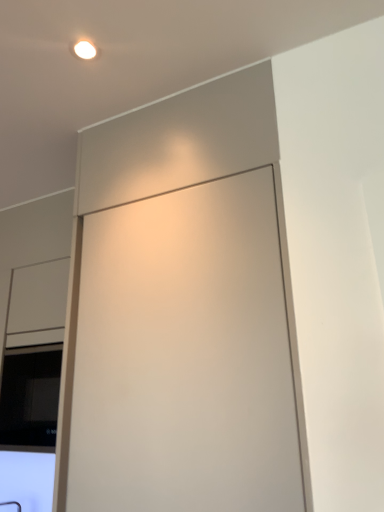
This screenshot has height=512, width=384. Describe the element at coordinates (30, 397) in the screenshot. I see `black glass window at lower left` at that location.

The height and width of the screenshot is (512, 384). In order to click on black glass window at lower left in this screenshot , I will do `click(30, 397)`.

The image size is (384, 512). What do you see at coordinates (185, 356) in the screenshot? I see `matte white cabinet at center` at bounding box center [185, 356].

Where is `matte white cabinet at center`? This screenshot has width=384, height=512. matte white cabinet at center is located at coordinates (185, 356).

This screenshot has width=384, height=512. What are the coordinates of `black glass window at lower left` in the screenshot? It's located at (30, 397).

Visually, is matte white cabinet at center positioned to the left or to the right of black glass window at lower left?

Based on their positions, matte white cabinet at center is located to the right of black glass window at lower left.

From the picture: Is matte white cabinet at center in front of black glass window at lower left?

Yes, the depth of matte white cabinet at center is less than that of black glass window at lower left.

Considering the points (248, 488) and (17, 415), which point is in front, point (248, 488) or point (17, 415)?

The point (248, 488) is closer to the camera.

Based on the photo, from the image's perspective, would you say matte white cabinet at center is shown under black glass window at lower left?

No.

From a real-world perspective, is matte white cabinet at center beneath black glass window at lower left?

No, from a real-world perspective, matte white cabinet at center is not below black glass window at lower left.

Is matte white cabinet at center wider or thinner than black glass window at lower left?

In the image, matte white cabinet at center appears to be wider than black glass window at lower left.

Which of these two, matte white cabinet at center or black glass window at lower left, stands shorter?

With less height is black glass window at lower left.

Between matte white cabinet at center and black glass window at lower left, which one has smaller size?

Smaller between the two is black glass window at lower left.

Do you think matte white cabinet at center is within black glass window at lower left, or outside of it?

matte white cabinet at center exists outside the volume of black glass window at lower left.

From the picture: Are matte white cabinet at center and black glass window at lower left far apart?

matte white cabinet at center is actually quite close to black glass window at lower left.

Is matte white cabinet at center positioned with its back to black glass window at lower left?

No, matte white cabinet at center is not facing away from black glass window at lower left.

Consider the image. Can you tell me how much matte white cabinet at center and black glass window at lower left differ in facing direction?

There is a 0.997-degree angle between the facing directions of matte white cabinet at center and black glass window at lower left.

Find the location of `window located below the matte white cabinet at center (from the image's perspective)`. window located below the matte white cabinet at center (from the image's perspective) is located at coordinates (30, 397).

Does black glass window at lower left appear on the right side of matte white cabinet at center?

In fact, black glass window at lower left is to the left of matte white cabinet at center.

Considering their positions, is black glass window at lower left located in front of or behind matte white cabinet at center?

Clearly, black glass window at lower left is behind matte white cabinet at center.

Does point (36, 411) come closer to viewer compared to point (95, 507)?

No, it is not.

From the image's perspective, is black glass window at lower left positioned above or below matte white cabinet at center?

Based on their image positions, black glass window at lower left is located beneath matte white cabinet at center.

From a real-world perspective, who is located higher, black glass window at lower left or matte white cabinet at center?

From a 3D spatial view, matte white cabinet at center is above.

Consider the image. Looking at their sizes, would you say black glass window at lower left is wider or thinner than matte white cabinet at center?

black glass window at lower left is thinner than matte white cabinet at center.

Between black glass window at lower left and matte white cabinet at center, which one has more height?

matte white cabinet at center is taller.

Who is smaller, black glass window at lower left or matte white cabinet at center?

black glass window at lower left is smaller.

Is black glass window at lower left spatially inside matte white cabinet at center, or outside of it?

The correct answer is: outside.

Would you say black glass window at lower left is a long distance from matte white cabinet at center?

Actually, black glass window at lower left and matte white cabinet at center are a little close together.

Is black glass window at lower left facing towards matte white cabinet at center?

No, black glass window at lower left is not turned towards matte white cabinet at center.

Where is `screen door above the black glass window at lower left (from the image's perspective)`? The width and height of the screenshot is (384, 512). screen door above the black glass window at lower left (from the image's perspective) is located at coordinates (185, 356).

At what (x,y) coordinates should I click in order to perform the action: click on window below the matte white cabinet at center (from the image's perspective). Please return your answer as a coordinate pair (x, y). The image size is (384, 512). Looking at the image, I should click on (30, 397).

Identify the location of screen door to the right of black glass window at lower left. This screenshot has width=384, height=512. (185, 356).